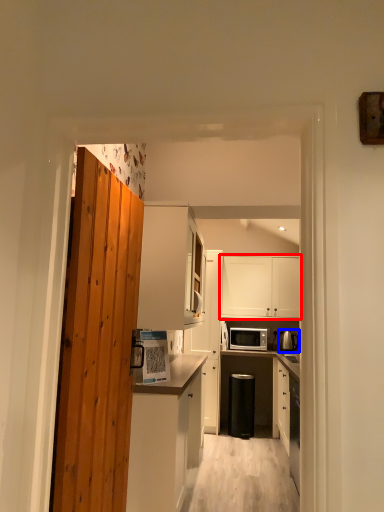
Question: Among these objects, which one is farthest to the camera, cabinetry (highlighted by a red box) or appliance (highlighted by a blue box)?

Choices:
 (A) cabinetry
 (B) appliance

Answer: (A)